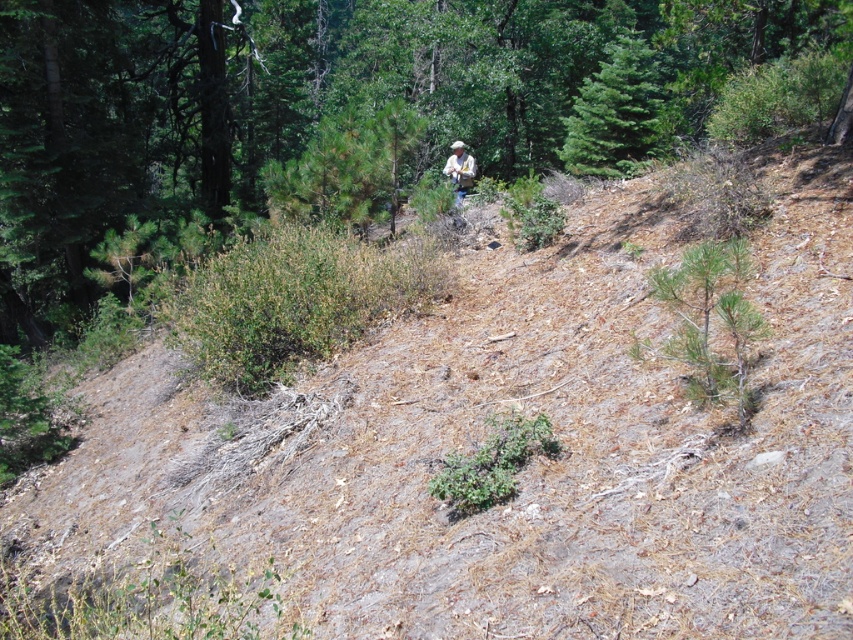
Which is in front, point (646, 81) or point (456, 192)?

Point (456, 192) is more forward.

Does green fir tree at upper center have a larger size compared to tan fabric shirt at center?

Actually, green fir tree at upper center might be smaller than tan fabric shirt at center.

Which is in front, point (654, 115) or point (448, 157)?

Positioned in front is point (654, 115).

Where is `green fir tree at upper center`? green fir tree at upper center is located at coordinates (616, 113).